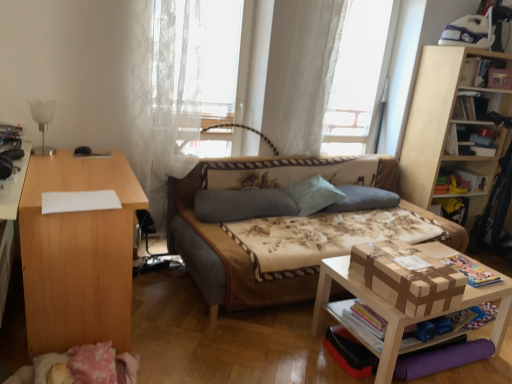
Image resolution: width=512 pixels, height=384 pixels. In order to click on empty space that is ontop of brown cardboard book at lower right, arranged as the fourth book when viewed from the back (from a real-world perspective) in this screenshot , I will do `click(470, 266)`.